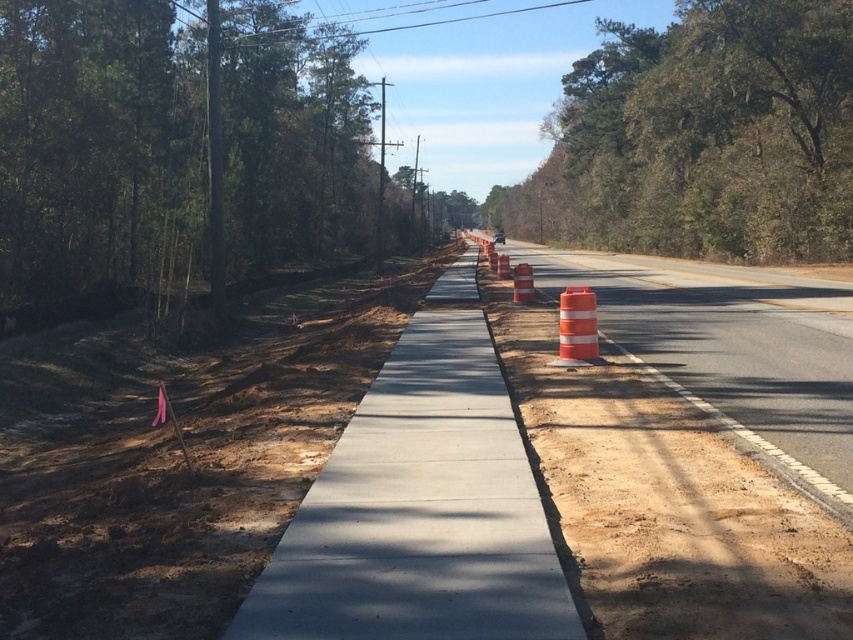
You are a delivery person driving a truck that is 2 meters wide. You need to navigate through the construction site shown in the image. Is there enough space between the orange reflective cone at center and the smooth concrete sidewalk at center to safely pass through with your truck?

The distance between the orange reflective cone at center and the smooth concrete sidewalk at center is 2.01 meters. Since your truck is 2 meters wide, there is just enough space to pass through safely.

You are a delivery drone flying over a construction site. You need to drop a package at point A, which is at coordinates point (753, 148), and then proceed to point B at coordinates point (438, 566). Considering the construction site layout, which point will you reach first when flying from your current position above the site?

You will reach point (438, 566) first because point (753, 148) is behind it, so point (438, 566) is closer to your current position above the site.

You are a surveyor standing at the construction site and need to determine the distance between two points marked on your map. The points are labeled as point 1 at coordinates point (668,336) and point 2 at coordinates point (442,474). According to the scene description, which point is closer to your current position?

Point (442,474) is closer to the viewer than point (668,336), so the surveyor is closer to point 2 at coordinates point (442,474).